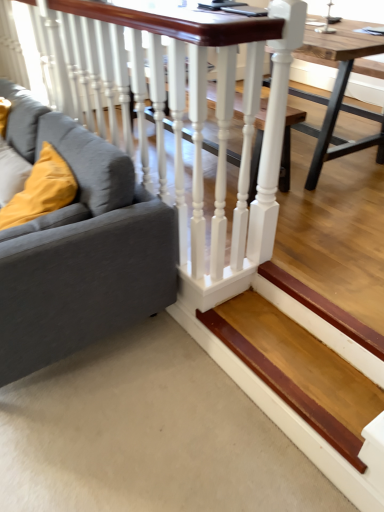
Question: From the image's perspective, relative to wooden table at center, is velvet yellow pillow at left above or below?

Choices:
 (A) above
 (B) below

Answer: (B)

Question: Do you think velvet yellow pillow at left is within wooden table at center, or outside of it?

Choices:
 (A) outside
 (B) inside

Answer: (A)

Question: Considering the real-world distances, which object is closest to the white glossy rail at upper left?

Choices:
 (A) wooden stair at lower right
 (B) wooden table at center
 (C) gray fabric couch at left
 (D) velvet yellow pillow at left

Answer: (C)

Question: Which object is positioned closest to the gray fabric couch at left?

Choices:
 (A) white glossy rail at upper left
 (B) wooden table at center
 (C) wooden stair at lower right
 (D) velvet yellow pillow at left

Answer: (D)